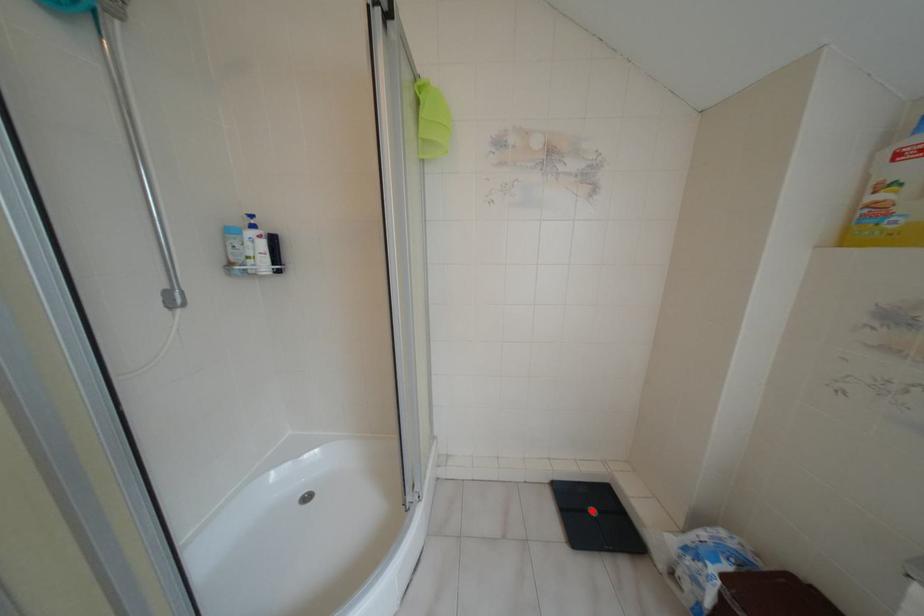
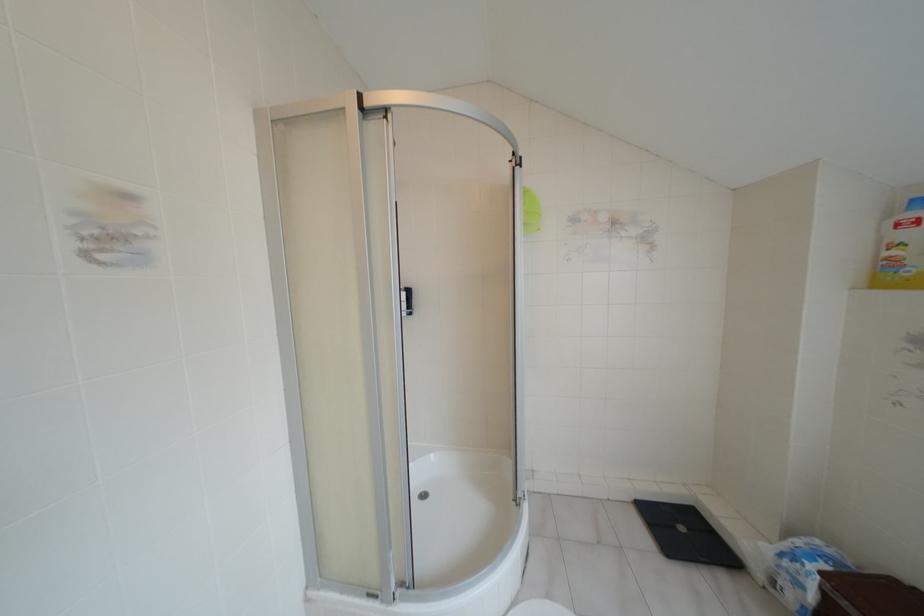
Where in the second image is the point corresponding to the highlighted location from the first image?

(681, 528)